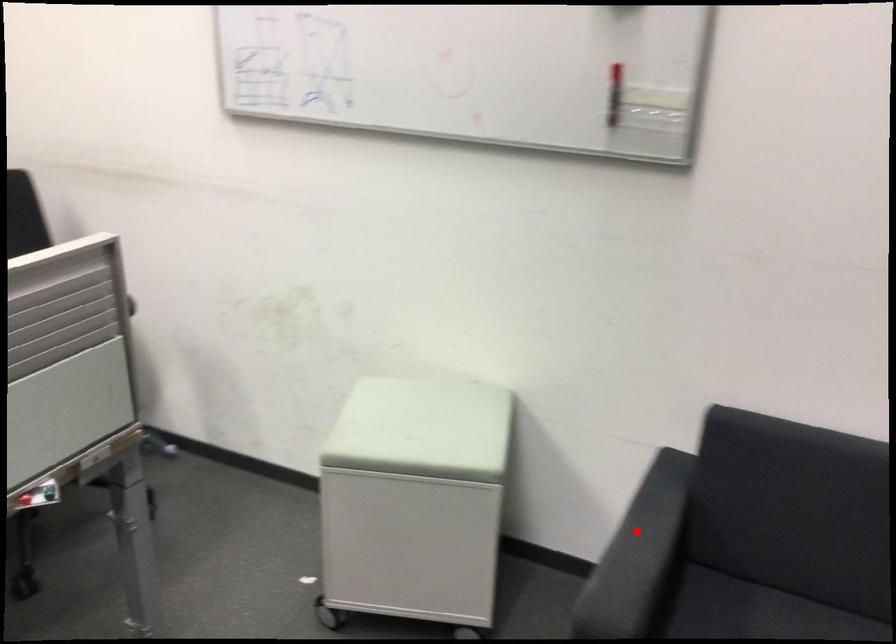
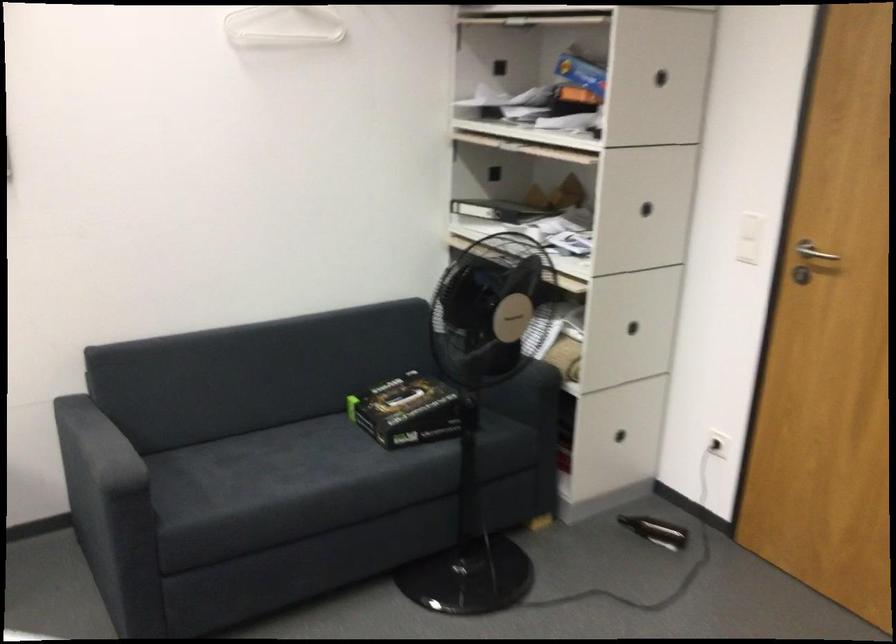
Where in the second image is the point corresponding to the highlighted location from the first image?

(93, 440)